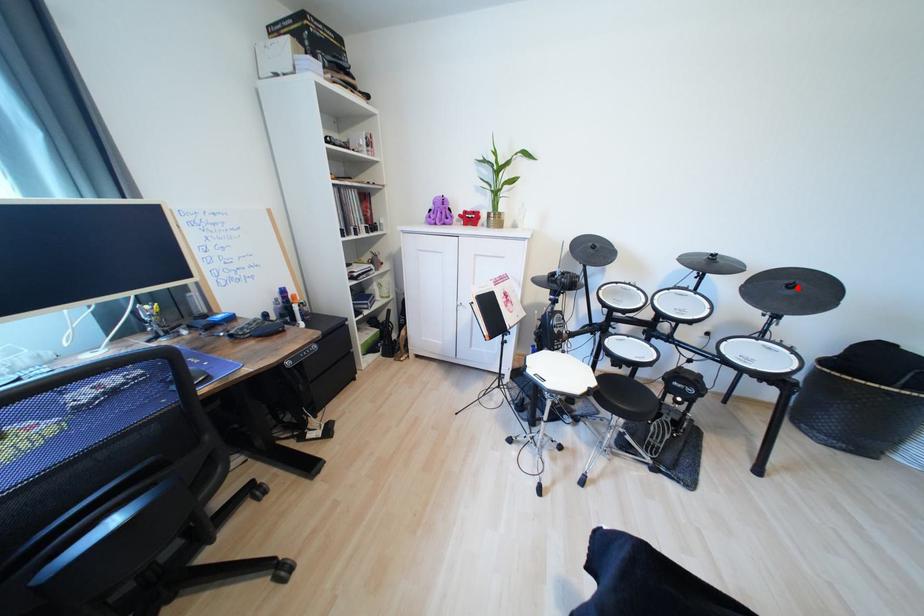
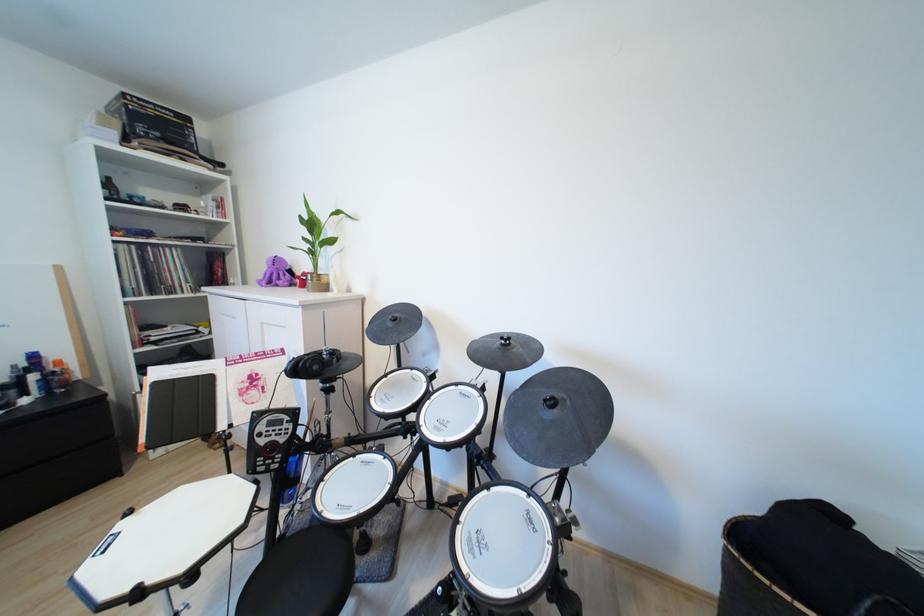
Question: I am providing you with two images of the same scene from different viewpoints. A red point is marked on the first image. At the location where the point appears in image 1, is it still visible in image 2?

Choices:
 (A) Yes
 (B) No

Answer: (A)